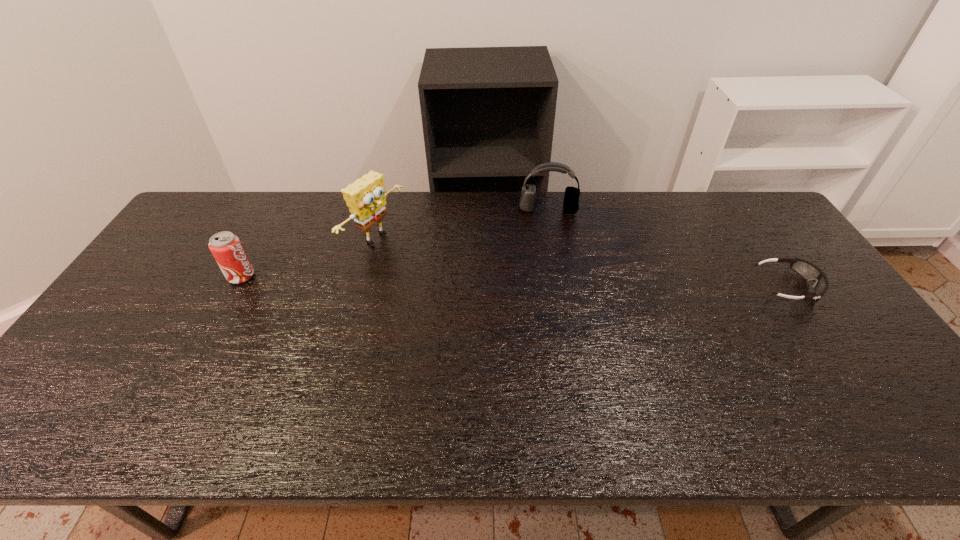
Where is `the leftmost object`? This screenshot has height=540, width=960. the leftmost object is located at coordinates (226, 247).

You are a GUI agent. You are given a task and a screenshot of the screen. Output one action in this format:
    pyautogui.click(x=<x>, y=<y>)
    Task: Click on the soda can
    The height and width of the screenshot is (540, 960).
    Given the screenshot: What is the action you would take?
    pyautogui.click(x=226, y=247)

This screenshot has height=540, width=960. I want to click on the shortest object, so click(808, 271).

Where is `the rightmost object`? This screenshot has width=960, height=540. the rightmost object is located at coordinates (808, 271).

I want to click on the second object from left to right, so click(366, 198).

Find the location of a particular element. This screenshot has height=540, width=960. headset is located at coordinates (571, 197).

Identify the location of the second object from right to left. This screenshot has width=960, height=540. (571, 197).

Find the location of a particular element. The height and width of the screenshot is (540, 960). blank space located 0.340m on the back of the soda can is located at coordinates (282, 201).

Identify the location of vacant space located 0.070m on the face of the sponge. (414, 261).

Find the location of `vacant space located 0.380m on the face of the sponge`. vacant space located 0.380m on the face of the sponge is located at coordinates (500, 303).